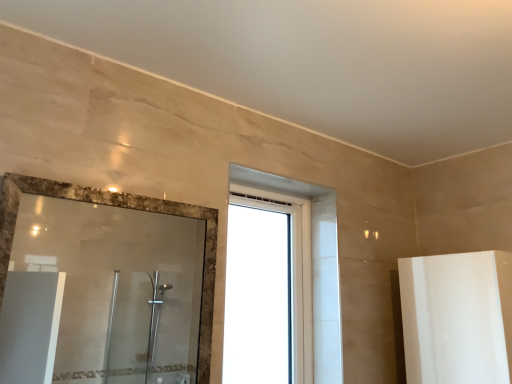
Measure the distance between point (316,213) and camera.

6.03 feet.

The width and height of the screenshot is (512, 384). In order to click on transparent glass window at center in this screenshot , I will do pyautogui.click(x=311, y=261).

This screenshot has width=512, height=384. What do you see at coordinates (311, 261) in the screenshot?
I see `transparent glass window at center` at bounding box center [311, 261].

This screenshot has width=512, height=384. Describe the element at coordinates (118, 285) in the screenshot. I see `polished glass mirror at left` at that location.

This screenshot has height=384, width=512. Identify the location of polished glass mirror at left. (118, 285).

Find the location of `transparent glass window at center`. transparent glass window at center is located at coordinates (311, 261).

Which is more to the right, transparent glass window at center or polished glass mirror at left?

transparent glass window at center.

Considering the relative positions of transparent glass window at center and polished glass mirror at left in the image provided, is transparent glass window at center behind polished glass mirror at left?

Yes, the depth of transparent glass window at center is greater than that of polished glass mirror at left.

Is point (329, 300) in front of point (179, 313)?

Yes, point (329, 300) is closer to viewer.

From the image's perspective, is transparent glass window at center on polished glass mirror at left?

No, from the image's perspective, transparent glass window at center is not above polished glass mirror at left.

From a real-world perspective, which object rests below the other?

polished glass mirror at left.

Does transparent glass window at center have a greater width compared to polished glass mirror at left?

Indeed, transparent glass window at center has a greater width compared to polished glass mirror at left.

Who is shorter, transparent glass window at center or polished glass mirror at left?

polished glass mirror at left.

In terms of size, does transparent glass window at center appear bigger or smaller than polished glass mirror at left?

In the image, transparent glass window at center appears to be larger than polished glass mirror at left.

Would you say transparent glass window at center is outside polished glass mirror at left?

Yes, transparent glass window at center is located beyond the bounds of polished glass mirror at left.

Is transparent glass window at center directly adjacent to polished glass mirror at left?

There is a gap between transparent glass window at center and polished glass mirror at left.

Could you tell me if transparent glass window at center is turned towards polished glass mirror at left?

No, transparent glass window at center is not aimed at polished glass mirror at left.

How different are the orientations of transparent glass window at center and polished glass mirror at left in degrees?

They differ by 0.48 degrees in their facing directions.

This screenshot has height=384, width=512. I want to click on window positioned vertically above the polished glass mirror at left (from a real-world perspective), so click(x=311, y=261).

Which is more to the left, polished glass mirror at left or transparent glass window at center?

polished glass mirror at left.

In the image, is polished glass mirror at left positioned in front of or behind transparent glass window at center?

polished glass mirror at left is positioned closer to the viewer than transparent glass window at center.

Considering the points (155, 239) and (318, 318), which point is behind, point (155, 239) or point (318, 318)?

The point (155, 239) is behind.

From the image's perspective, between polished glass mirror at left and transparent glass window at center, who is located below?

transparent glass window at center appears lower in the image.

From a real-world perspective, is polished glass mirror at left below transparent glass window at center?

Yes.

Looking at their sizes, would you say polished glass mirror at left is wider or thinner than transparent glass window at center?

Considering their sizes, polished glass mirror at left looks slimmer than transparent glass window at center.

Consider the image. Is polished glass mirror at left taller or shorter than transparent glass window at center?

polished glass mirror at left is shorter than transparent glass window at center.

Can you confirm if polished glass mirror at left is smaller than transparent glass window at center?

Yes.

Could transparent glass window at center be considered to be inside polished glass mirror at left?

Actually, transparent glass window at center is outside polished glass mirror at left.

Is polished glass mirror at left beside transparent glass window at center?

No, polished glass mirror at left is not in contact with transparent glass window at center.

Is polished glass mirror at left oriented towards transparent glass window at center?

No, polished glass mirror at left is not facing towards transparent glass window at center.

How different are the orientations of polished glass mirror at left and transparent glass window at center in degrees?

There is a 0.48-degree angle between the facing directions of polished glass mirror at left and transparent glass window at center.

Where is `mirror on the left of transparent glass window at center`? This screenshot has height=384, width=512. mirror on the left of transparent glass window at center is located at coordinates (118, 285).

Find the location of `mirror lying on the left of transparent glass window at center`. mirror lying on the left of transparent glass window at center is located at coordinates (118, 285).

At what (x,y) coordinates should I click in order to perform the action: click on mirror above the transparent glass window at center (from the image's perspective). Please return your answer as a coordinate pair (x, y). Looking at the image, I should click on (118, 285).